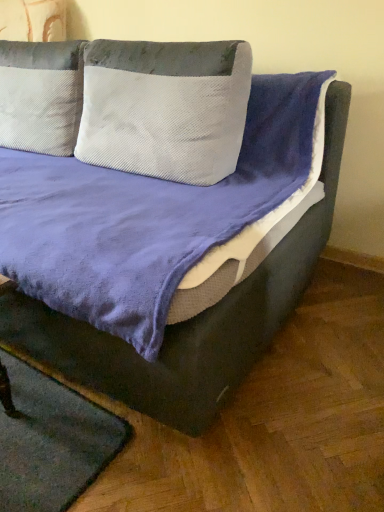
Identify the location of green felt mat at lower left. (51, 442).

Where is `velvet purple bed at center`? velvet purple bed at center is located at coordinates (192, 315).

Is velvet purple bed at center bigger than green felt mat at lower left?

Yes.

Considering the relative sizes of velvet purple bed at center and green felt mat at lower left in the image provided, is velvet purple bed at center shorter than green felt mat at lower left?

No, velvet purple bed at center is not shorter than green felt mat at lower left.

Is velvet purple bed at center in front of or behind green felt mat at lower left in the image?

In the image, velvet purple bed at center appears in front of green felt mat at lower left.

Which point is more distant from viewer, (x=214, y=297) or (x=49, y=476)?

Positioned behind is point (x=49, y=476).

Is green felt mat at lower left in contact with velvet purple bed at center?

No, green felt mat at lower left is not in contact with velvet purple bed at center.

Consider the image. Considering the positions of objects green felt mat at lower left and velvet purple bed at center in the image provided, who is behind, green felt mat at lower left or velvet purple bed at center?

green felt mat at lower left.

Does white textured pillow at center lie in front of velvet purple bed at center?

No, white textured pillow at center is further to the viewer.

Is point (158, 120) positioned behind point (330, 205)?

No, (158, 120) is in front of (330, 205).

From the image's perspective, is white textured pillow at center on velvet purple bed at center?

Yes.

Consider the image. Is white textured pillow at center to the right of velvet purple bed at center from the viewer's perspective?

Yes, white textured pillow at center is to the right of velvet purple bed at center.

Is velvet purple bed at center bigger than white textured pillow at center?

Yes, velvet purple bed at center is bigger than white textured pillow at center.

Considering the relative positions of velvet purple bed at center and white textured pillow at center in the image provided, is velvet purple bed at center to the right of white textured pillow at center from the viewer's perspective?

No, velvet purple bed at center is not to the right of white textured pillow at center.

Is white textured pillow at center at the back of velvet purple bed at center?

Absolutely, velvet purple bed at center is directed away from white textured pillow at center.

How many degrees apart are the facing directions of velvet purple bed at center and white textured pillow at center?

The facing directions of velvet purple bed at center and white textured pillow at center are 3.08 degrees apart.

From a real-world perspective, between green felt mat at lower left and white textured pillow at center, who is vertically higher?

In real-world perspective, white textured pillow at center is above.

Is green felt mat at lower left not near white textured pillow at center?

No, there isn't a large distance between green felt mat at lower left and white textured pillow at center.

Is the depth of green felt mat at lower left greater than that of white textured pillow at center?

That is False.

At what (x,y) coordinates should I click in order to perform the action: click on pillow behind the green felt mat at lower left. Please return your answer as a coordinate pair (x, y). Image resolution: width=384 pixels, height=512 pixels. Looking at the image, I should click on (165, 108).

Which is behind, white textured pillow at center or green felt mat at lower left?

white textured pillow at center.

From the picture: From a real-world perspective, is white textured pillow at center physically located above or below green felt mat at lower left?

white textured pillow at center is above green felt mat at lower left.

How many degrees apart are the facing directions of white textured pillow at center and green felt mat at lower left?

2.21 degrees separate the facing orientations of white textured pillow at center and green felt mat at lower left.

Is white textured pillow at center aimed at green felt mat at lower left?

No, white textured pillow at center is not oriented towards green felt mat at lower left.

At what (x,y) coordinates should I click in order to perform the action: click on bed above the green felt mat at lower left (from a real-world perspective). Please return your answer as a coordinate pair (x, y). This screenshot has height=512, width=384. Looking at the image, I should click on (192, 315).

Find the location of a particular element. The height and width of the screenshot is (512, 384). bed above the green felt mat at lower left (from the image's perspective) is located at coordinates click(x=192, y=315).

Estimate the real-world distances between objects in this image. Which object is closer to white textured pillow at center, velvet purple bed at center or green felt mat at lower left?

Based on the image, velvet purple bed at center appears to be nearer to white textured pillow at center.

Considering their positions, is white textured pillow at center positioned further to velvet purple bed at center than green felt mat at lower left?

Among the two, green felt mat at lower left is located further to velvet purple bed at center.

Based on their spatial positions, is velvet purple bed at center or white textured pillow at center further from green felt mat at lower left?

white textured pillow at center lies further to green felt mat at lower left than the other object.

In the scene shown: From the image, which object appears to be nearer to white textured pillow at center, green felt mat at lower left or velvet purple bed at center?

velvet purple bed at center.

Based on their spatial positions, is white textured pillow at center or velvet purple bed at center closer to green felt mat at lower left?

Based on the image, velvet purple bed at center appears to be nearer to green felt mat at lower left.

Looking at the image, which one is located further to velvet purple bed at center, green felt mat at lower left or white textured pillow at center?

green felt mat at lower left is positioned further to the anchor velvet purple bed at center.

You are a GUI agent. You are given a task and a screenshot of the screen. Output one action in this format:
    pyautogui.click(x=<x>, y=<y>)
    Task: Click on the bed between white textured pillow at center and green felt mat at lower left vertically
    
    Given the screenshot: What is the action you would take?
    pyautogui.click(x=192, y=315)